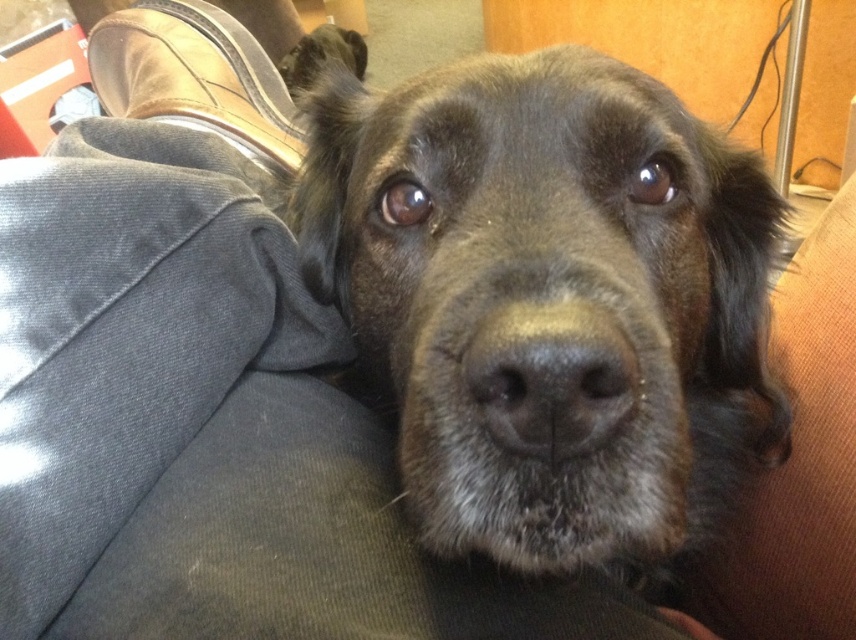
Between point (495, 554) and point (522, 378), which one is positioned behind?

The point (495, 554) is more distant.

Can you confirm if shiny black fur at center is taller than black matte nose at center?

Indeed, shiny black fur at center has a greater height compared to black matte nose at center.

What do you see at coordinates (550, 300) in the screenshot? Image resolution: width=856 pixels, height=640 pixels. I see `shiny black fur at center` at bounding box center [550, 300].

Where is `shiny black fur at center`? shiny black fur at center is located at coordinates (550, 300).